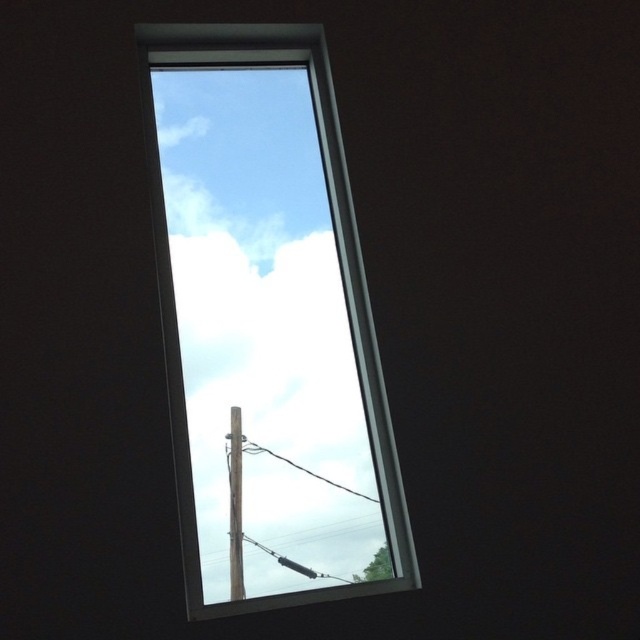
Question: Is transparent glass window at upper center bigger than smooth metallic pole at center?

Choices:
 (A) yes
 (B) no

Answer: (A)

Question: Which point is closer to the camera?

Choices:
 (A) transparent glass window at upper center
 (B) smooth metallic pole at center

Answer: (A)

Question: Is transparent glass window at upper center to the left of smooth metallic pole at center from the viewer's perspective?

Choices:
 (A) no
 (B) yes

Answer: (A)

Question: Is transparent glass window at upper center further to camera compared to smooth metallic pole at center?

Choices:
 (A) yes
 (B) no

Answer: (B)

Question: Among these points, which one is farthest from the camera?

Choices:
 (A) (237, 410)
 (B) (253, 196)

Answer: (B)

Question: Among these points, which one is nearest to the camera?

Choices:
 (A) (164, 161)
 (B) (237, 408)

Answer: (B)